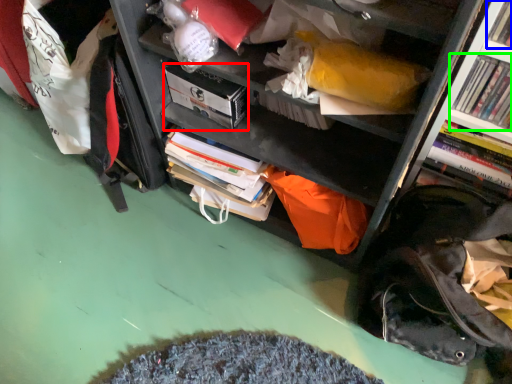
Question: Based on their relative distances, which object is nearer to paperback book (highlighted by a red box)? Choose from book (highlighted by a blue box) and book (highlighted by a green box).

Choices:
 (A) book
 (B) book

Answer: (B)